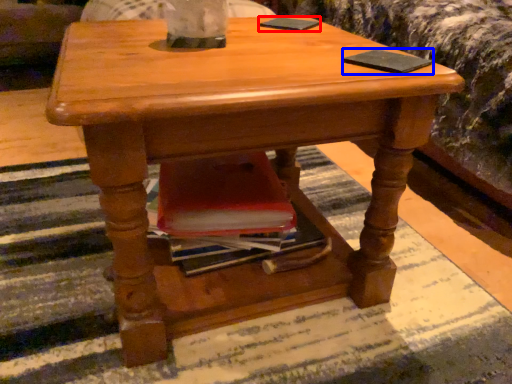
Question: Which of the following is the closest to the observer, pad (highlighted by a red box) or pad (highlighted by a blue box)?

Choices:
 (A) pad
 (B) pad

Answer: (B)